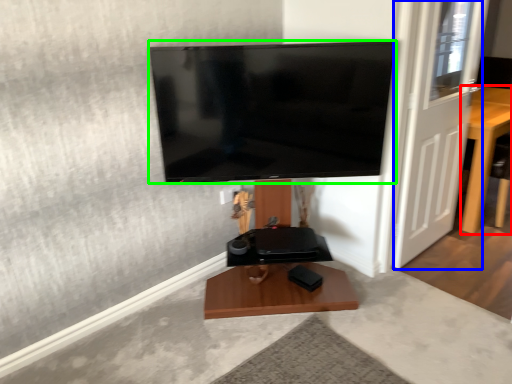
Question: Which object is the closest to the furniture (highlighted by a red box)? Choose among these: door (highlighted by a blue box) or television (highlighted by a green box).

Choices:
 (A) door
 (B) television

Answer: (A)